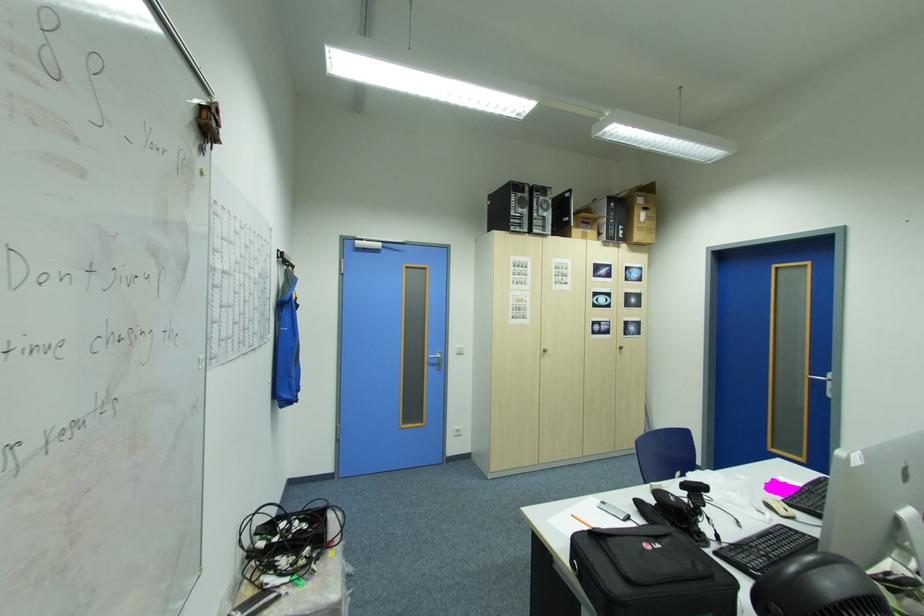
Where is `black bag handle`? black bag handle is located at coordinates (650, 573).